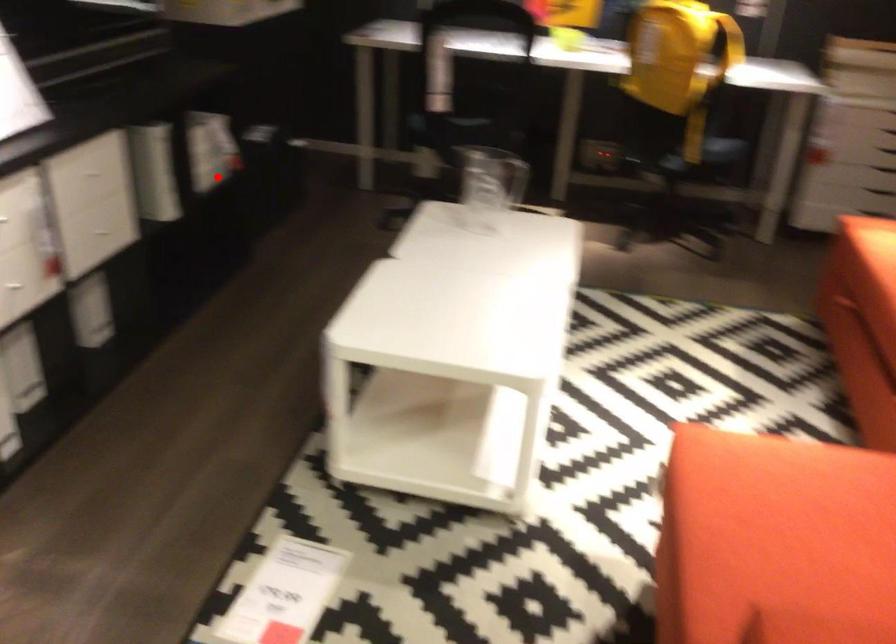
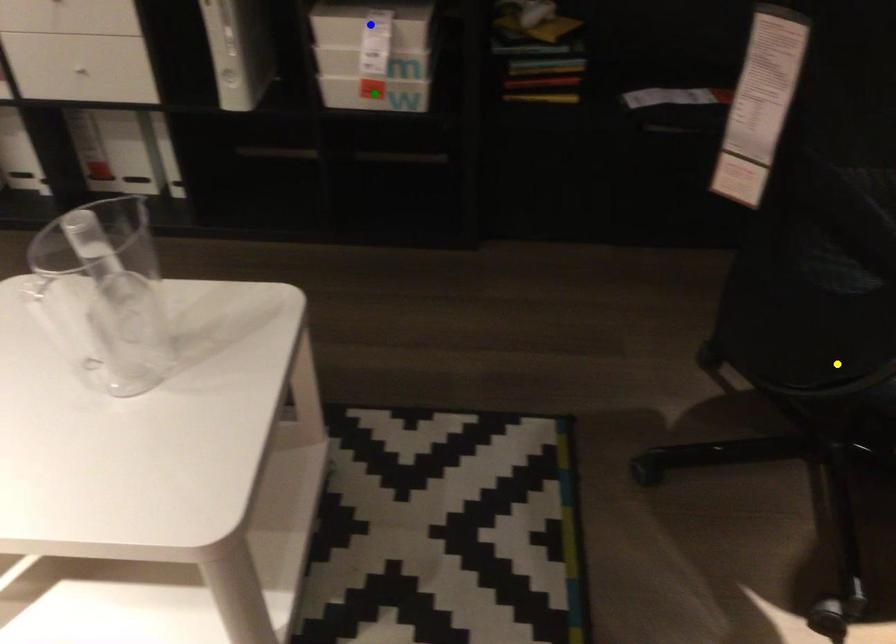
Question: I am providing you with two images of the same scene from different viewpoints. A red point is marked on the first image. You are given multiple points on the second image. In image 2, which mark is for the same physical point as the one in image 1?

Choices:
 (A) blue point
 (B) yellow point
 (C) green point

Answer: (C)